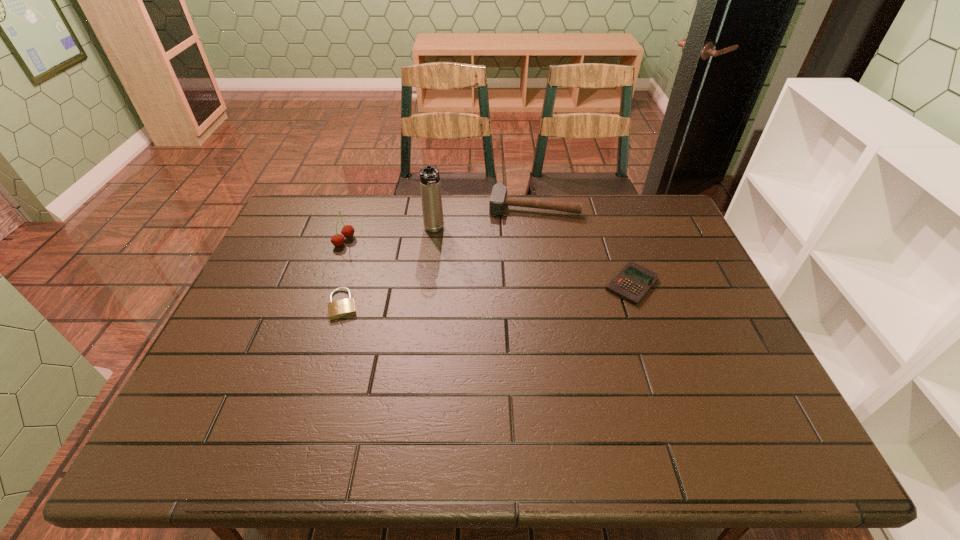
Locate an element on the screen. free space between the second shortest object and the farthest object is located at coordinates [x=583, y=245].

The height and width of the screenshot is (540, 960). I want to click on vacant space in between the fourth tallest object and the shortest object, so click(x=488, y=294).

The image size is (960, 540). What are the coordinates of `vacant area that lies between the rightmost object and the tallest object` in the screenshot? It's located at click(533, 257).

You are a GUI agent. You are given a task and a screenshot of the screen. Output one action in this format:
    pyautogui.click(x=<x>, y=<y>)
    Task: Click on the unoccupied area between the cherry and the shortest object
    
    Given the screenshot: What is the action you would take?
    pyautogui.click(x=344, y=273)

This screenshot has height=540, width=960. Identify the location of vacant space that's between the third object from left to right and the rightmost object. (533, 257).

Identify the location of empty space between the fourth tallest object and the padlock. (488, 294).

Where is `vacant space that is in between the third tallest object and the shortest object`? This screenshot has height=540, width=960. vacant space that is in between the third tallest object and the shortest object is located at coordinates (439, 255).

Where is `vacant space in between the calculator and the tallest object`? vacant space in between the calculator and the tallest object is located at coordinates (533, 257).

Locate an element on the screen. object that can be found as the fourth closest to the farthest object is located at coordinates (338, 309).

At what (x,y) coordinates should I click in order to perform the action: click on object that is the third nearest to the hammer. Please return your answer as a coordinate pair (x, y). The width and height of the screenshot is (960, 540). Looking at the image, I should click on (347, 231).